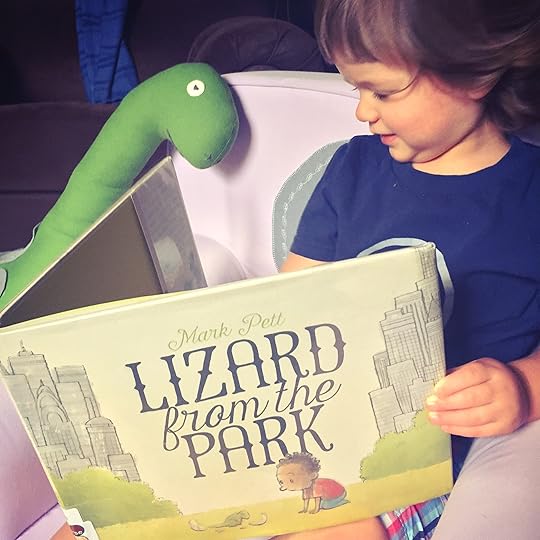
I want to click on chair, so click(x=503, y=507).